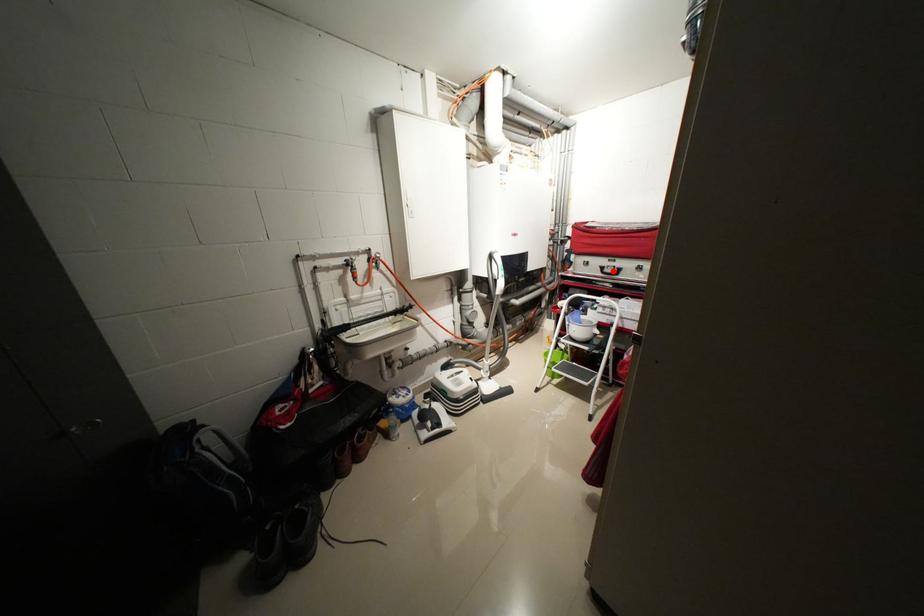
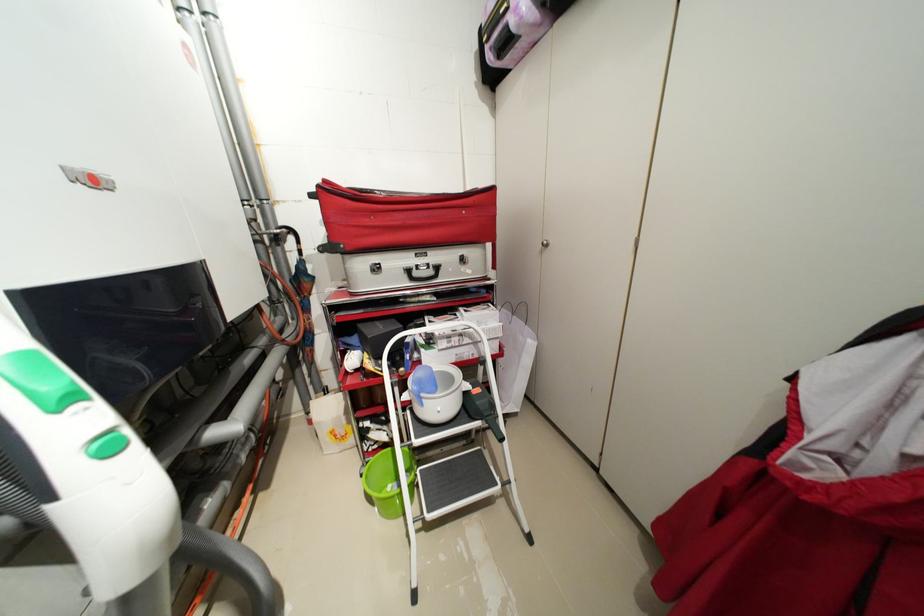
The point at the highlighted location is marked in the first image. Where is the corresponding point in the second image?

(422, 275)